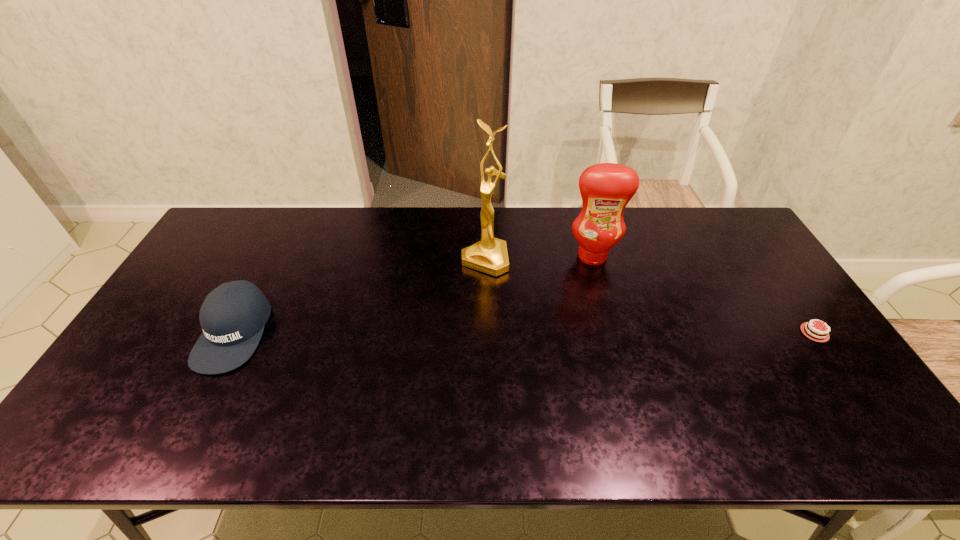
I want to click on free region located on the label side of the condiment, so click(601, 349).

The height and width of the screenshot is (540, 960). Find the location of `free space located 0.310m on the label side of the condiment`. free space located 0.310m on the label side of the condiment is located at coordinates (600, 343).

Image resolution: width=960 pixels, height=540 pixels. In order to click on free space located 0.210m on the front-facing side of the award in this screenshot , I will do `click(447, 323)`.

Where is `vacant space located 0.200m on the front-facing side of the award`? The width and height of the screenshot is (960, 540). vacant space located 0.200m on the front-facing side of the award is located at coordinates (448, 321).

Locate an element on the screen. This screenshot has height=540, width=960. vacant space situated on the front-facing side of the award is located at coordinates (456, 309).

Identify the location of condiment at the far edge. (606, 188).

At what (x,y) coordinates should I click in order to perform the action: click on award present at the far edge. Please return your answer as a coordinate pair (x, y). The width and height of the screenshot is (960, 540). Looking at the image, I should click on (489, 255).

At what (x,y) coordinates should I click in order to perform the action: click on object located in the left edge section of the desktop. Please return your answer as a coordinate pair (x, y). The width and height of the screenshot is (960, 540). Looking at the image, I should click on (233, 316).

Find the location of `object located in the right edge section of the desktop`. object located in the right edge section of the desktop is located at coordinates (821, 337).

Identify the location of free space at the far edge. (386, 237).